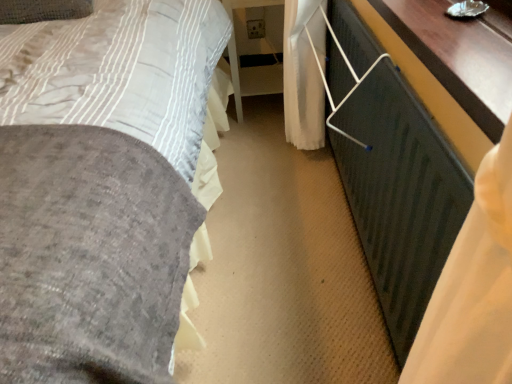
Question: Which is correct: velvet gray bed at center is inside white glossy table at center, the 1th table in the left-to-right sequence, or outside of it?

Choices:
 (A) outside
 (B) inside

Answer: (A)

Question: Based on their positions, is velvet gray bed at center located to the left or right of white glossy table at center, the 2th table when ordered from front to back?

Choices:
 (A) right
 (B) left

Answer: (B)

Question: Which of these objects is positioned closest to the wooden table at right, which is the 2th table in left-to-right order?

Choices:
 (A) velvet gray bed at center
 (B) white glossy table at center, the second table in the right-to-left sequence
 (C) metallic silver balustrade at lower right

Answer: (C)

Question: Which object is positioned closest to the metallic silver balustrade at lower right?

Choices:
 (A) white glossy table at center, the 2th table when ordered from front to back
 (B) wooden table at right, the first table when ordered from right to left
 (C) velvet gray bed at center

Answer: (B)